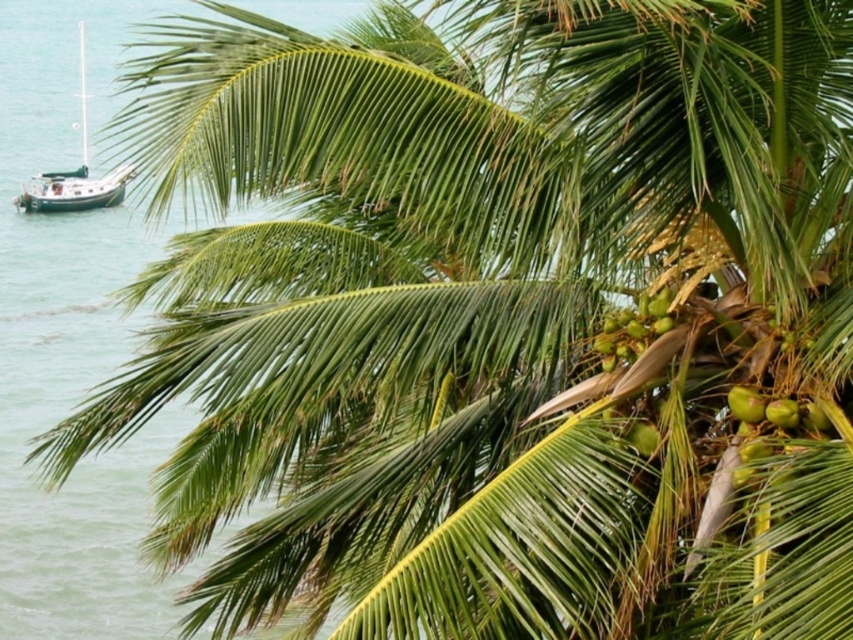
Question: Can you confirm if wooden sailboat at left is thinner than green matte coconuts at upper right?

Choices:
 (A) no
 (B) yes

Answer: (A)

Question: Among these points, which one is nearest to the camera?

Choices:
 (A) (741, 413)
 (B) (79, 54)

Answer: (A)

Question: Can you confirm if wooden sailboat at left is positioned above green matte coconuts at upper right?

Choices:
 (A) no
 (B) yes

Answer: (B)

Question: Which point appears closest to the camera in this image?

Choices:
 (A) (64, 205)
 (B) (618, 355)

Answer: (B)

Question: Can you confirm if green matte coconuts at upper right is smaller than green matte coconut at upper right?

Choices:
 (A) no
 (B) yes

Answer: (A)

Question: Which of these objects is positioned closest to the wooden sailboat at left?

Choices:
 (A) green matte coconuts at upper right
 (B) green matte coconut at upper right

Answer: (A)